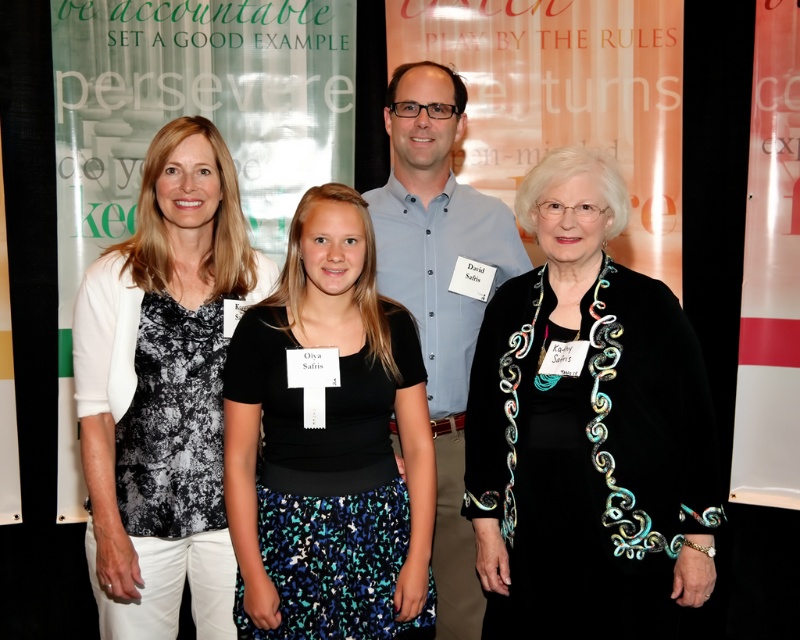
You are a photographer setting up for a group photo. You have two options for the subjects to wear in the center of the image. The black jersey at center and the black textured dress at center. Which one will be more visible from the front due to its length?

The black jersey at center is shorter than the black textured dress at center, so the black textured dress at center will be more visible from the front because its longer length allows it to stand out more against the backdrop.

From the picture: Based on the scene description, where is the black textured dress at center located in terms of its 2D coordinates?

The black textured dress at center is located at the 2D coordinates of point (572, 227).